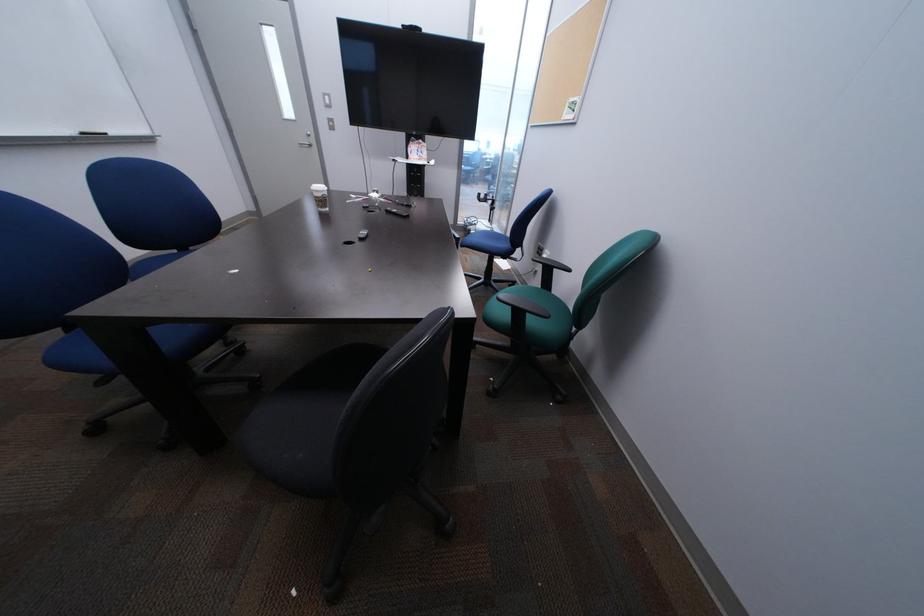
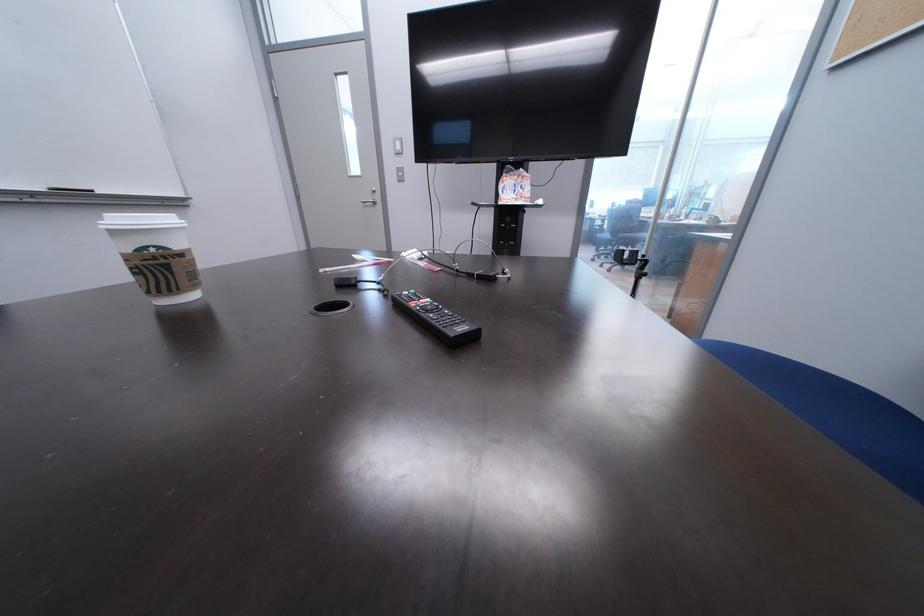
Question: Which direction would the cameraman need to move to produce the second image? Reply with the corresponding letter.

Choices:
 (A) Left
 (B) Right
 (C) Forward
 (D) Backward

Answer: (C)